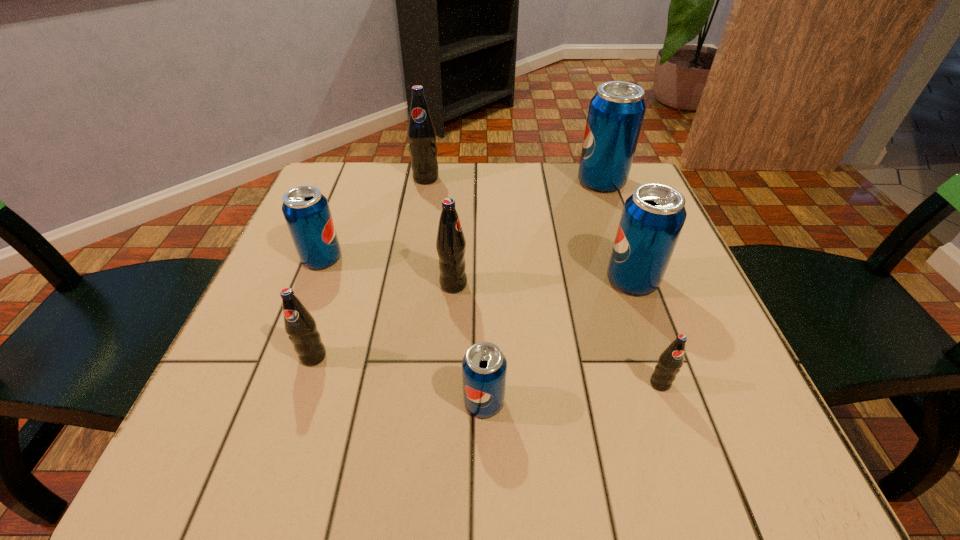
Choose which pop is the third nearest neighbor to the third farthest black pop. Please provide its 2D coordinates. Your answer should be formatted as a tuple, i.e. [(x, y)], where the tuple contains the x and y coordinates of a point satisfying the conditions above.

[(484, 367)]

Point out which pop is positioned as the fifth nearest to the third blue pop soda from right to left. Please provide its 2D coordinates. Your answer should be formatted as a tuple, i.e. [(x, y)], where the tuple contains the x and y coordinates of a point satisfying the conditions above.

[(306, 210)]

Where is `the third closest blue pop soda to the smallest black pop`? Image resolution: width=960 pixels, height=540 pixels. the third closest blue pop soda to the smallest black pop is located at coordinates (616, 112).

Find the location of `the closest blue pop soda to the leftmost black pop`. the closest blue pop soda to the leftmost black pop is located at coordinates (306, 210).

You are a GUI agent. You are given a task and a screenshot of the screen. Output one action in this format:
    pyautogui.click(x=<x>, y=<y>)
    Task: Click on the second closest black pop to the third pop from left to right
    This screenshot has height=540, width=960.
    Given the screenshot: What is the action you would take?
    pyautogui.click(x=301, y=327)

Select which black pop is the closest to the leftmost blue pop soda. Please provide its 2D coordinates. Your answer should be formatted as a tuple, i.e. [(x, y)], where the tuple contains the x and y coordinates of a point satisfying the conditions above.

[(301, 327)]

Locate an element on the screen. The width and height of the screenshot is (960, 540). vacant region that satisfies the following two spatial constraints: 1. on the front label of the leftmost black pop; 2. on the right side of the smallest blue pop soda is located at coordinates (299, 402).

Locate an element on the screen. vacant region that satisfies the following two spatial constraints: 1. on the front label of the third black pop from right to left; 2. on the right side of the smallest blue pop soda is located at coordinates (389, 402).